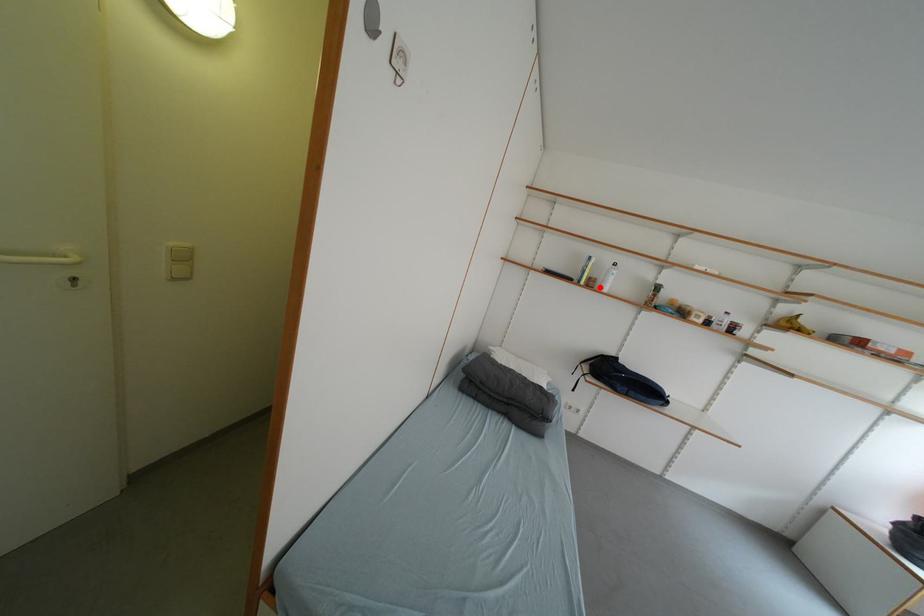
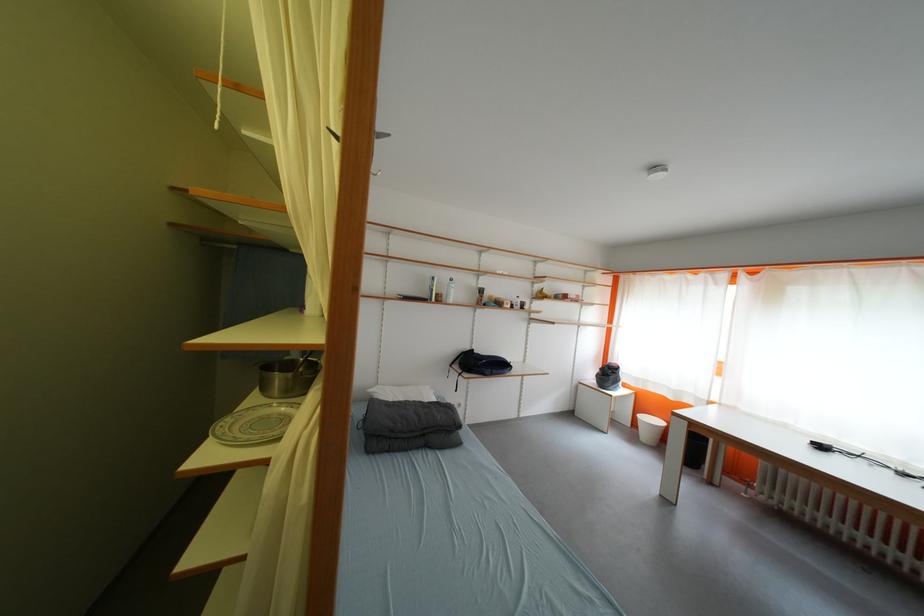
Locate, in the second image, the point that corresponds to the highlighted location in the first image.

(447, 302)